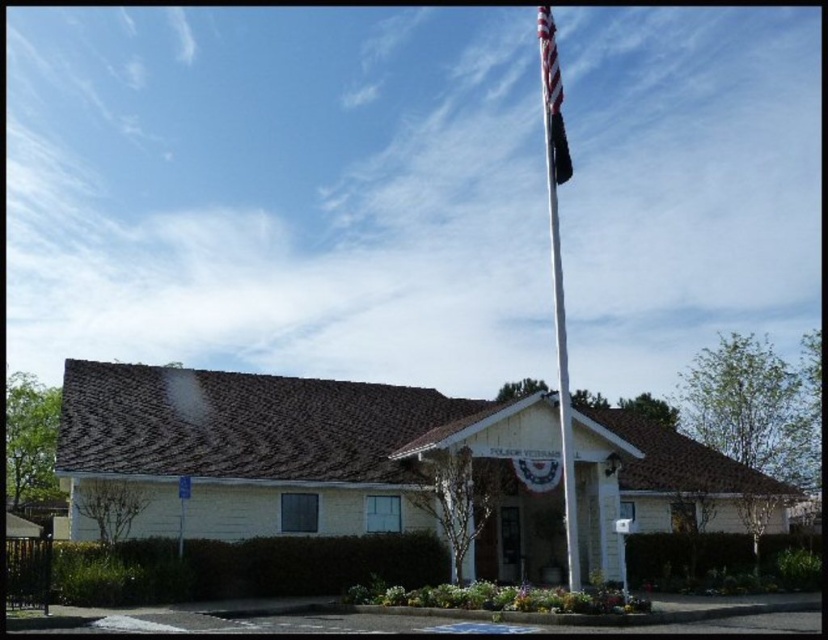
Question: Does white metallic flag pole at upper center have a smaller size compared to american flag at upper right?

Choices:
 (A) yes
 (B) no

Answer: (B)

Question: Can you confirm if white metallic flag pole at upper center is thinner than american flag at upper right?

Choices:
 (A) no
 (B) yes

Answer: (A)

Question: Is white metallic flag pole at upper center bigger than american flag at upper right?

Choices:
 (A) yes
 (B) no

Answer: (A)

Question: Which object is closer to the camera taking this photo?

Choices:
 (A) american flag at upper right
 (B) white metallic flag pole at upper center

Answer: (A)